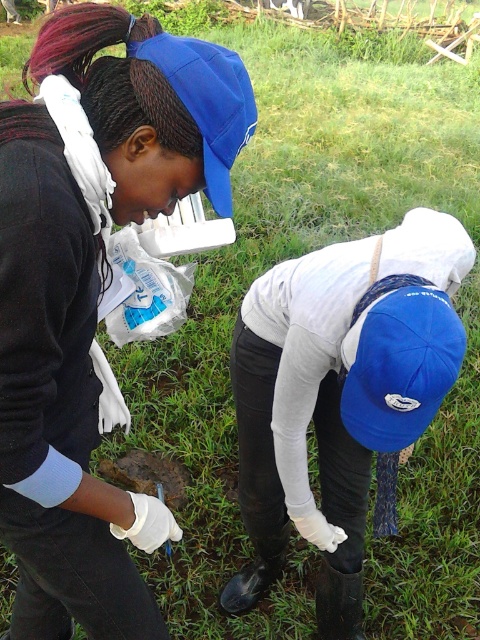
Question: Among these points, which one is nearest to the camera?

Choices:
 (A) (264, 346)
 (B) (349, 420)

Answer: (B)

Question: Can you confirm if white matte gloves at lower center is bigger than blue fabric baseball cap at lower center?

Choices:
 (A) yes
 (B) no

Answer: (A)

Question: Which point is farther from the camera taking this photo?

Choices:
 (A) (406, 230)
 (B) (373, 314)

Answer: (A)

Question: Is the position of white matte gloves at lower center less distant than that of blue fabric baseball cap at lower center?

Choices:
 (A) yes
 (B) no

Answer: (B)

Question: Does white matte gloves at lower center have a lesser width compared to blue fabric baseball cap at lower center?

Choices:
 (A) yes
 (B) no

Answer: (B)